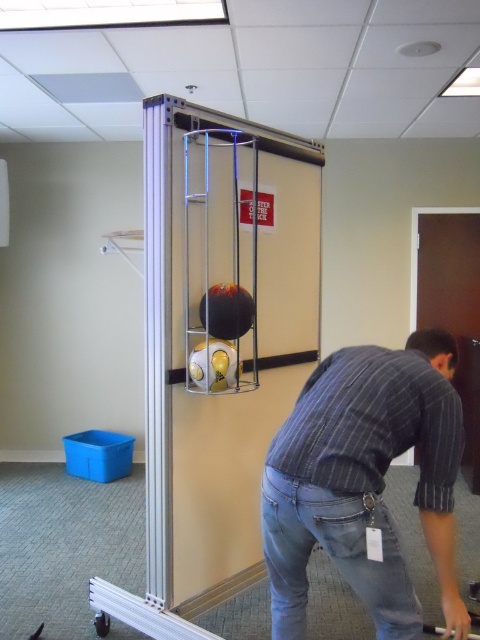
You are standing in front of the metal structure with soccer balls. There are two points marked on the structure. Which point is closer to you, point (x=247, y=330) or point (x=229, y=349)?

Point (x=247, y=330) is further to the viewer than point (x=229, y=349), so point (x=229, y=349) is closer to you.

You are standing in an office and see the blue denim jeans at lower center and the shiny black bowling ball at center. Which object is taller?

The blue denim jeans at lower center is much taller than the shiny black bowling ball at center.

You are organizing items in an office and need to move the striped cotton shirt at lower right and the shiny black bowling ball at center. Which item is closer to you if you are standing in front of the structure?

The striped cotton shirt at lower right is closer to you because it is in front of the shiny black bowling ball at center.